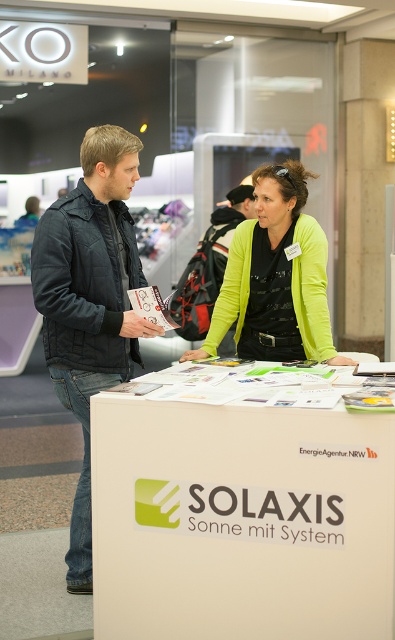
You are attending a trade fair and want to approach the SOLAXIS booth to inquire about their solar solutions. You see the white cardboard sign at center and the lime green sweater at center. Which object should you look toward first to locate the booth?

You should look toward the white cardboard sign at center first because it is positioned to the left of the lime green sweater at center, indicating its location as part of the booth signage.

You are a visitor at the trade fair and want to read the information on the white cardboard sign at center. The dark blue quilted jacket at left is blocking your view. Which direction should you move to see the sign better?

The white cardboard sign at center is to the right of the dark blue quilted jacket at left. To see the sign better, you should move to the right side of the dark blue quilted jacket at left so that the sign comes into view without obstruction.

You are at the SOLAXIS booth and need to hand a brochure to the person wearing the dark blue quilted jacket at left. Which direction should you approach from relative to the matte black jacket at left?

The dark blue quilted jacket at left is to the left of the matte black jacket at left, so you should approach from the left side of the matte black jacket at left to reach the person in the dark blue quilted jacket at left.